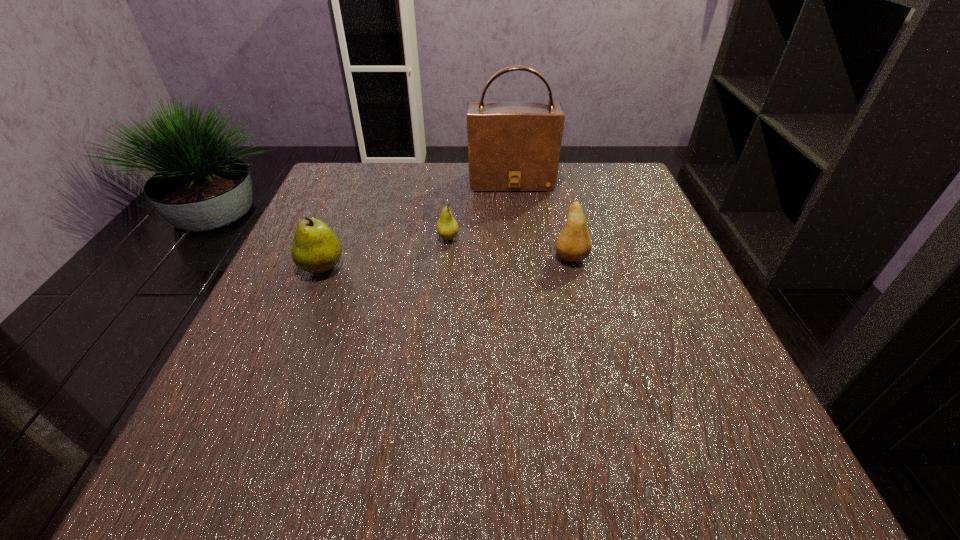
I want to click on the tallest object, so click(x=512, y=146).

You are a GUI agent. You are given a task and a screenshot of the screen. Output one action in this format:
    pyautogui.click(x=<x>, y=<y>)
    Task: Click on the farthest object
    
    Given the screenshot: What is the action you would take?
    pyautogui.click(x=512, y=146)

The image size is (960, 540). What are the coordinates of `the leftmost pear` in the screenshot? It's located at (316, 249).

The height and width of the screenshot is (540, 960). Identify the location of the rightmost pear. (573, 244).

I want to click on the shortest pear, so click(447, 227).

Image resolution: width=960 pixels, height=540 pixels. Find the location of `the shortest object`. the shortest object is located at coordinates (447, 227).

You are a GUI agent. You are given a task and a screenshot of the screen. Output one action in this format:
    pyautogui.click(x=<x>, y=<y>)
    Task: Click on the free space located on the front flap of the farthest object
    The image size is (960, 540).
    Given the screenshot: What is the action you would take?
    pyautogui.click(x=524, y=307)

At what (x,y) coordinates should I click in order to perform the action: click on free region located 0.140m on the front of the leftmost pear. Please return your answer as a coordinate pair (x, y). Looking at the image, I should click on (292, 340).

Locate an element on the screen. blank space located 0.120m on the left of the rightmost pear is located at coordinates (493, 258).

The height and width of the screenshot is (540, 960). I want to click on vacant space located 0.190m on the left of the third nearest object, so click(x=347, y=238).